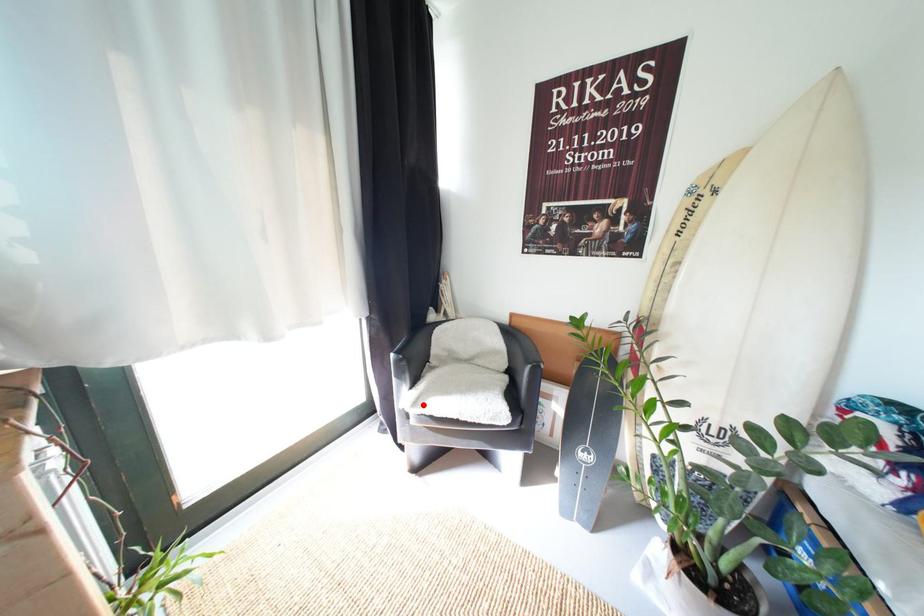
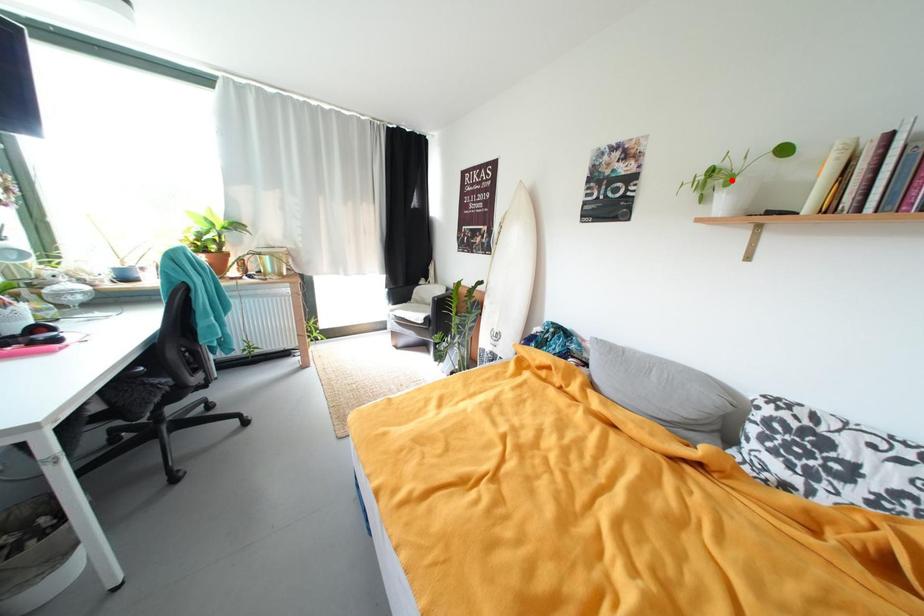
I am providing you with two images of the same scene from different viewpoints. A red point is marked on the first image and another point is marked on the second image. Do the highlighted points in image1 and image2 indicate the same real-world spot?

No